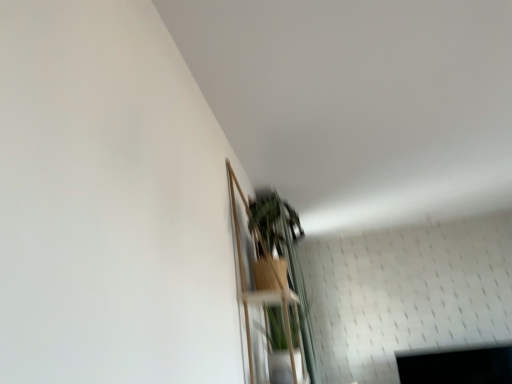
Describe the element at coordinates (268, 326) in the screenshot. Image resolution: width=512 pixels, height=384 pixels. I see `wooden shelf at lower center, which ranks as the second shelf in top-to-bottom order` at that location.

The width and height of the screenshot is (512, 384). In order to click on wooden shelf at lower center, which ranks as the second shelf in top-to-bottom order in this screenshot , I will do [x=268, y=326].

What do you see at coordinates (265, 290) in the screenshot?
I see `wooden shelf at upper center, the second shelf in the bottom-to-top sequence` at bounding box center [265, 290].

Where is `wooden shelf at upper center, the second shelf in the bottom-to-top sequence`? wooden shelf at upper center, the second shelf in the bottom-to-top sequence is located at coordinates (265, 290).

The width and height of the screenshot is (512, 384). I want to click on wooden shelf at lower center, the first shelf ordered from the bottom, so click(268, 326).

Between wooden shelf at lower center, which ranks as the second shelf in top-to-bottom order, and wooden shelf at upper center, the second shelf in the bottom-to-top sequence, which one appears on the left side from the viewer's perspective?

Positioned to the left is wooden shelf at upper center, the second shelf in the bottom-to-top sequence.

Which object is closer to the camera, wooden shelf at lower center, which ranks as the second shelf in top-to-bottom order, or wooden shelf at upper center, the 1th shelf positioned from the top?

wooden shelf at upper center, the 1th shelf positioned from the top, is more forward.

Is point (286, 322) farther from viewer compared to point (257, 303)?

No, (286, 322) is in front of (257, 303).

From the image's perspective, is wooden shelf at lower center, which ranks as the second shelf in top-to-bottom order, above or below wooden shelf at upper center, the second shelf in the bottom-to-top sequence?

Based on their image positions, wooden shelf at lower center, which ranks as the second shelf in top-to-bottom order, is located beneath wooden shelf at upper center, the second shelf in the bottom-to-top sequence.

From a real-world perspective, is wooden shelf at lower center, the first shelf ordered from the bottom, positioned over wooden shelf at upper center, the second shelf in the bottom-to-top sequence, based on gravity?

Incorrect, from a real-world perspective, wooden shelf at lower center, the first shelf ordered from the bottom, is lower than wooden shelf at upper center, the second shelf in the bottom-to-top sequence.

In terms of width, does wooden shelf at lower center, which ranks as the second shelf in top-to-bottom order, look wider or thinner when compared to wooden shelf at upper center, the second shelf in the bottom-to-top sequence?

wooden shelf at lower center, which ranks as the second shelf in top-to-bottom order, is wider than wooden shelf at upper center, the second shelf in the bottom-to-top sequence.

Can you confirm if wooden shelf at lower center, the first shelf ordered from the bottom, is taller than wooden shelf at upper center, the second shelf in the bottom-to-top sequence?

No.

Who is bigger, wooden shelf at lower center, which ranks as the second shelf in top-to-bottom order, or wooden shelf at upper center, the second shelf in the bottom-to-top sequence?

With larger size is wooden shelf at upper center, the second shelf in the bottom-to-top sequence.

Is wooden shelf at lower center, which ranks as the second shelf in top-to-bottom order, surrounding wooden shelf at upper center, the second shelf in the bottom-to-top sequence?

That's incorrect, wooden shelf at upper center, the second shelf in the bottom-to-top sequence, is not inside wooden shelf at lower center, which ranks as the second shelf in top-to-bottom order.

Is wooden shelf at upper center, the 1th shelf positioned from the top, at the back of wooden shelf at lower center, which ranks as the second shelf in top-to-bottom order?

Yes, wooden shelf at lower center, which ranks as the second shelf in top-to-bottom order, is positioned with its back facing wooden shelf at upper center, the 1th shelf positioned from the top.

How many degrees apart are the facing directions of wooden shelf at lower center, which ranks as the second shelf in top-to-bottom order, and wooden shelf at upper center, the 1th shelf positioned from the top?

0.000251 degrees.

How much distance is there between wooden shelf at lower center, which ranks as the second shelf in top-to-bottom order, and wooden shelf at upper center, the second shelf in the bottom-to-top sequence?

3.96 inches.

You are a GUI agent. You are given a task and a screenshot of the screen. Output one action in this format:
    pyautogui.click(x=<x>, y=<y>)
    Task: Click on the shelf located behind the wooden shelf at upper center, the 1th shelf positioned from the top
    
    Given the screenshot: What is the action you would take?
    pyautogui.click(x=268, y=326)

Which object is positioned more to the left, wooden shelf at upper center, the second shelf in the bottom-to-top sequence, or wooden shelf at lower center, which ranks as the second shelf in top-to-bottom order?

Positioned to the left is wooden shelf at upper center, the second shelf in the bottom-to-top sequence.

Is wooden shelf at upper center, the second shelf in the bottom-to-top sequence, positioned before wooden shelf at lower center, which ranks as the second shelf in top-to-bottom order?

Yes, the depth of wooden shelf at upper center, the second shelf in the bottom-to-top sequence, is less than that of wooden shelf at lower center, which ranks as the second shelf in top-to-bottom order.

Is point (234, 236) closer to camera compared to point (298, 343)?

Yes, it is in front of point (298, 343).

From the image's perspective, which is below, wooden shelf at upper center, the 1th shelf positioned from the top, or wooden shelf at lower center, which ranks as the second shelf in top-to-bottom order?

wooden shelf at lower center, which ranks as the second shelf in top-to-bottom order, from the image's perspective.

From a real-world perspective, which object rests below the other?

In real-world perspective, wooden shelf at lower center, the first shelf ordered from the bottom, is lower.

Which object is thinner, wooden shelf at upper center, the 1th shelf positioned from the top, or wooden shelf at lower center, which ranks as the second shelf in top-to-bottom order?

Thinner between the two is wooden shelf at upper center, the 1th shelf positioned from the top.

Is wooden shelf at upper center, the second shelf in the bottom-to-top sequence, shorter than wooden shelf at lower center, the first shelf ordered from the bottom?

Incorrect, the height of wooden shelf at upper center, the second shelf in the bottom-to-top sequence, does not fall short of that of wooden shelf at lower center, the first shelf ordered from the bottom.

Does wooden shelf at upper center, the 1th shelf positioned from the top, have a smaller size compared to wooden shelf at lower center, which ranks as the second shelf in top-to-bottom order?

Actually, wooden shelf at upper center, the 1th shelf positioned from the top, might be larger than wooden shelf at lower center, which ranks as the second shelf in top-to-bottom order.

Is wooden shelf at lower center, the first shelf ordered from the bottom, located within wooden shelf at upper center, the second shelf in the bottom-to-top sequence?

Yes, wooden shelf at lower center, the first shelf ordered from the bottom, is surrounded by wooden shelf at upper center, the second shelf in the bottom-to-top sequence.

Does wooden shelf at upper center, the second shelf in the bottom-to-top sequence, touch wooden shelf at lower center, which ranks as the second shelf in top-to-bottom order?

No, wooden shelf at upper center, the second shelf in the bottom-to-top sequence, is not next to wooden shelf at lower center, which ranks as the second shelf in top-to-bottom order.

Could you tell me if wooden shelf at upper center, the 1th shelf positioned from the top, is facing wooden shelf at lower center, which ranks as the second shelf in top-to-bottom order?

Yes, wooden shelf at upper center, the 1th shelf positioned from the top, faces towards wooden shelf at lower center, which ranks as the second shelf in top-to-bottom order.

What's the angular difference between wooden shelf at upper center, the 1th shelf positioned from the top, and wooden shelf at lower center, the first shelf ordered from the bottom,'s facing directions?

The angular difference between wooden shelf at upper center, the 1th shelf positioned from the top, and wooden shelf at lower center, the first shelf ordered from the bottom, is 0.000251 degrees.

Measure the distance from wooden shelf at upper center, the 1th shelf positioned from the top, to wooden shelf at lower center, the first shelf ordered from the bottom.

A distance of 3.96 inches exists between wooden shelf at upper center, the 1th shelf positioned from the top, and wooden shelf at lower center, the first shelf ordered from the bottom.

At what (x,y) coordinates should I click in order to perform the action: click on shelf lying in front of the wooden shelf at lower center, the first shelf ordered from the bottom. Please return your answer as a coordinate pair (x, y). Looking at the image, I should click on (265, 290).

Locate an element on the screen. shelf behind the wooden shelf at upper center, the 1th shelf positioned from the top is located at coordinates coord(268,326).

Identify the location of shelf above the wooden shelf at lower center, the first shelf ordered from the bottom (from a real-world perspective). (265, 290).